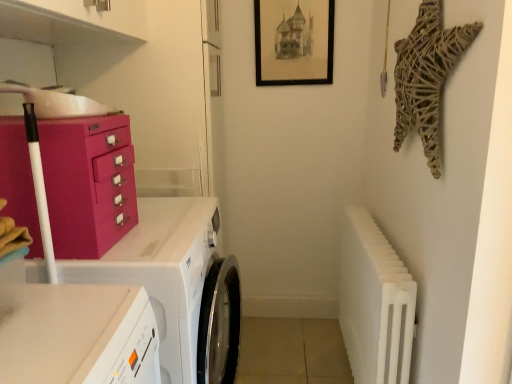
Question: From the image's perspective, is matte pink cabinet at left under white glossy washing machine at lower left?

Choices:
 (A) no
 (B) yes

Answer: (A)

Question: From a real-world perspective, is matte pink cabinet at left located beneath white glossy washing machine at lower left?

Choices:
 (A) no
 (B) yes

Answer: (A)

Question: Is matte pink cabinet at left positioned with its back to white glossy washing machine at lower left?

Choices:
 (A) no
 (B) yes

Answer: (A)

Question: Is matte pink cabinet at left closer to the viewer compared to white glossy washing machine at lower left?

Choices:
 (A) yes
 (B) no

Answer: (A)

Question: Is matte pink cabinet at left outside of white glossy washing machine at lower left?

Choices:
 (A) yes
 (B) no

Answer: (A)

Question: Does matte pink cabinet at left appear on the right side of white glossy washing machine at lower left?

Choices:
 (A) yes
 (B) no

Answer: (B)

Question: Considering the relative positions of matte pink cabinet at left and black matte picture frame at upper center in the image provided, is matte pink cabinet at left to the left of black matte picture frame at upper center from the viewer's perspective?

Choices:
 (A) no
 (B) yes

Answer: (B)

Question: Is black matte picture frame at upper center at the back of matte pink cabinet at left?

Choices:
 (A) yes
 (B) no

Answer: (B)

Question: Does matte pink cabinet at left have a greater width compared to black matte picture frame at upper center?

Choices:
 (A) no
 (B) yes

Answer: (B)

Question: From a real-world perspective, is matte pink cabinet at left on black matte picture frame at upper center?

Choices:
 (A) no
 (B) yes

Answer: (A)

Question: From a real-world perspective, is matte pink cabinet at left positioned under black matte picture frame at upper center based on gravity?

Choices:
 (A) no
 (B) yes

Answer: (B)

Question: Considering the relative sizes of matte pink cabinet at left and black matte picture frame at upper center in the image provided, is matte pink cabinet at left shorter than black matte picture frame at upper center?

Choices:
 (A) yes
 (B) no

Answer: (A)

Question: Is white glossy washing machine at lower left not within white ribbed radiator at right?

Choices:
 (A) no
 (B) yes

Answer: (B)